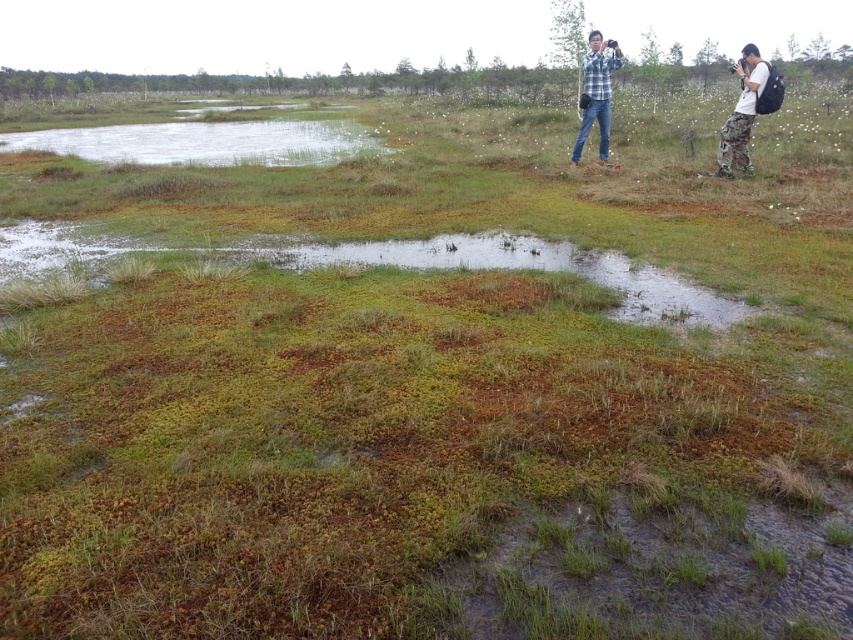
Can you confirm if blue plaid shirt at upper center is taller than camouflage pants at right?

No.

How distant is blue plaid shirt at upper center from camouflage pants at right?

The distance of blue plaid shirt at upper center from camouflage pants at right is 28.10 inches.

Between point (601, 92) and point (741, 113), which one is positioned in front?

Point (741, 113) is in front.

Locate an element on the screen. Image resolution: width=853 pixels, height=640 pixels. blue plaid shirt at upper center is located at coordinates (746, 109).

Can you confirm if blue plaid shirt at upper right is shorter than camouflage pants at right?

Yes.

Who is more forward, (595, 72) or (721, 156)?

Point (721, 156) is in front.

Find the location of a particular element. The image size is (853, 640). blue plaid shirt at upper right is located at coordinates (596, 92).

Is point (747, 157) positioned before point (595, 116)?

Yes, point (747, 157) is closer to viewer.

Can you confirm if blue plaid shirt at upper center is smaller than blue plaid shirt at upper right?

No, blue plaid shirt at upper center is not smaller than blue plaid shirt at upper right.

Identify the location of blue plaid shirt at upper center. (746, 109).